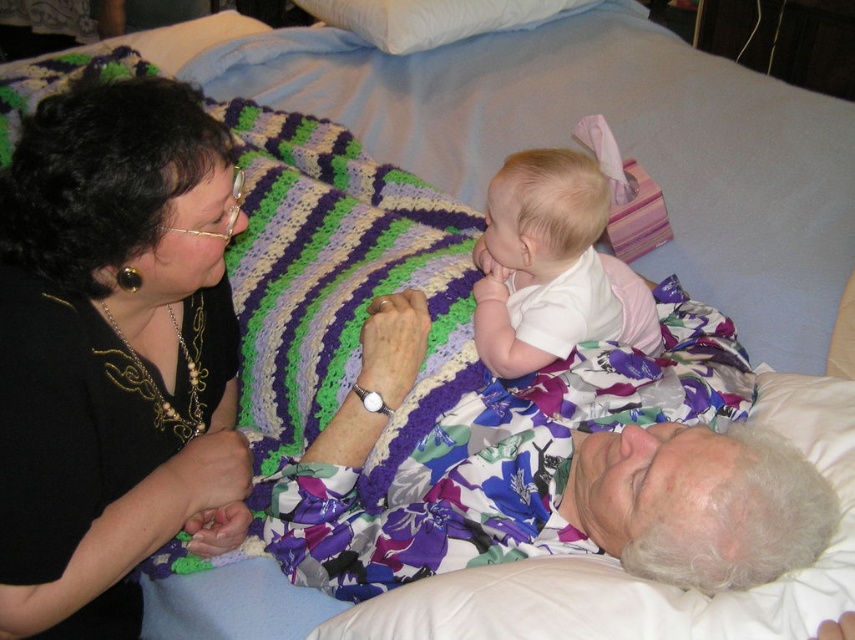
You are a photographer taking a picture of the white soft baby at center. To avoid including the black fabric at upper left in the photo, should you move the camera to the left or right?

Move the camera to the right. The black fabric at upper left is to the left of the white soft baby at center, so moving the camera right would position it away from the black fabric.

You are standing at the point labeled as point (416, 12) and want to move to the point labeled as point (78, 472). Which direction should you move in to reach your destination?

You should move forward to reach point (78, 472) from point (416, 12) because point (78, 472) is in front of point (416, 12).

You are designing a nursery and want to place a small nightlight between the black fabric at upper left and the white soft baby at center. Based on their sizes, which object requires more space horizontally?

The white soft baby at center requires more space horizontally because its width is greater than the black fabric at upper left.